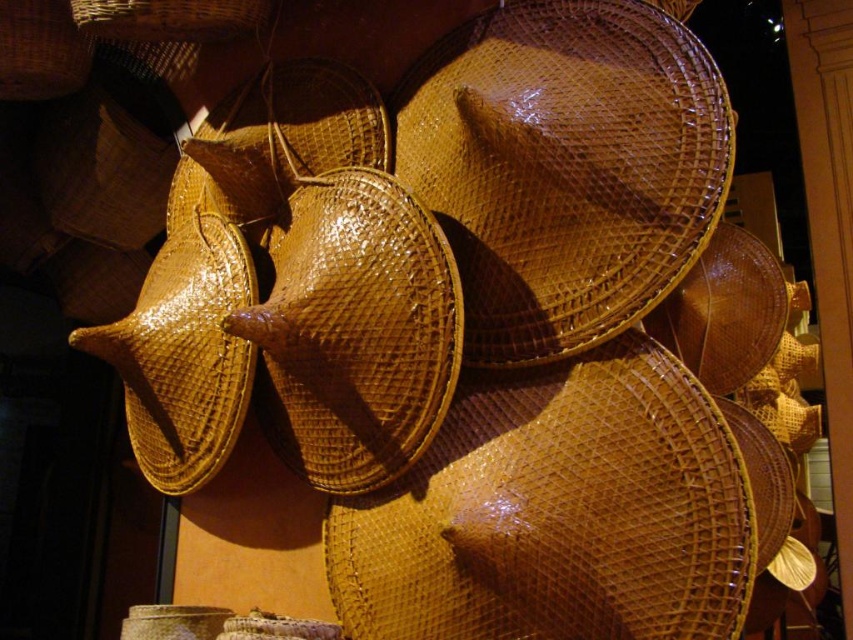
Question: Among these objects, which one is nearest to the camera?

Choices:
 (A) woven brown basket at upper left
 (B) matte brown woven basket at upper left

Answer: (A)

Question: Can you confirm if matte brown woven basket at upper left is positioned above woven brown basket at upper left?

Choices:
 (A) no
 (B) yes

Answer: (B)

Question: Considering the relative positions of matte brown woven basket at upper left and woven brown basket at upper left in the image provided, where is matte brown woven basket at upper left located with respect to woven brown basket at upper left?

Choices:
 (A) right
 (B) left

Answer: (B)

Question: Which point is farther from the camera taking this photo?

Choices:
 (A) (210, 38)
 (B) (64, 70)

Answer: (B)

Question: Is matte brown woven basket at upper left below woven brown basket at upper left?

Choices:
 (A) yes
 (B) no

Answer: (B)